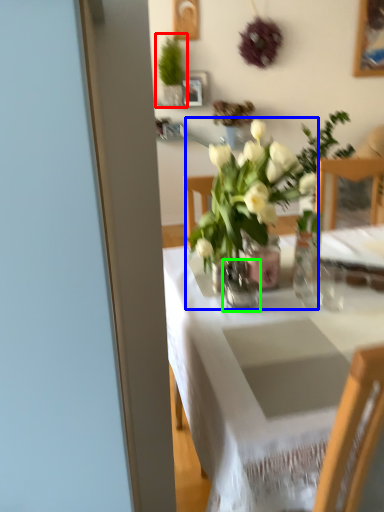
Question: Considering the real-world distances, which object is farthest from houseplant (highlighted by a red box)? houseplant (highlighted by a blue box) or vase (highlighted by a green box)?

Choices:
 (A) houseplant
 (B) vase

Answer: (B)